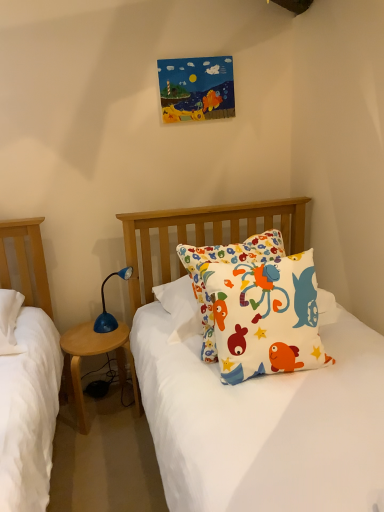
Question: Is blue plastic lamp at lower left inside white cotton pillow with colorful fish designs at center?

Choices:
 (A) yes
 (B) no

Answer: (B)

Question: Can you confirm if white cotton pillow with colorful fish designs at center is taller than blue plastic lamp at lower left?

Choices:
 (A) no
 (B) yes

Answer: (B)

Question: Considering the relative sizes of white cotton pillow with colorful fish designs at center and blue plastic lamp at lower left in the image provided, is white cotton pillow with colorful fish designs at center smaller than blue plastic lamp at lower left?

Choices:
 (A) yes
 (B) no

Answer: (B)

Question: Is white cotton pillow with colorful fish designs at center at the right side of blue plastic lamp at lower left?

Choices:
 (A) yes
 (B) no

Answer: (A)

Question: From a real-world perspective, is white cotton pillow with colorful fish designs at center physically below blue plastic lamp at lower left?

Choices:
 (A) yes
 (B) no

Answer: (B)

Question: Is point (238, 308) positioned closer to the camera than point (61, 337)?

Choices:
 (A) closer
 (B) farther

Answer: (A)

Question: In terms of width, does white cotton pillow with colorful fish designs at center look wider or thinner when compared to wooden nightstand at left?

Choices:
 (A) wide
 (B) thin

Answer: (B)

Question: In the image, is white cotton pillow with colorful fish designs at center on the left side or the right side of wooden nightstand at left?

Choices:
 (A) left
 (B) right

Answer: (B)

Question: Is white cotton pillow with colorful fish designs at center in front of or behind wooden nightstand at left in the image?

Choices:
 (A) behind
 (B) front

Answer: (B)

Question: Is blue plastic lamp at lower left inside the boundaries of white cotton pillow with colorful fish designs at center, or outside?

Choices:
 (A) outside
 (B) inside

Answer: (A)

Question: Considering the positions of blue plastic lamp at lower left and white cotton pillow with colorful fish designs at center in the image, is blue plastic lamp at lower left wider or thinner than white cotton pillow with colorful fish designs at center?

Choices:
 (A) thin
 (B) wide

Answer: (A)

Question: Considering the positions of blue plastic lamp at lower left and white cotton pillow with colorful fish designs at center in the image, is blue plastic lamp at lower left bigger or smaller than white cotton pillow with colorful fish designs at center?

Choices:
 (A) big
 (B) small

Answer: (B)

Question: From the image's perspective, is blue plastic lamp at lower left positioned above or below white cotton pillow with colorful fish designs at center?

Choices:
 (A) below
 (B) above

Answer: (A)

Question: In the image, is wooden nightstand at left positioned in front of or behind white cotton pillow with colorful fish designs at center?

Choices:
 (A) behind
 (B) front

Answer: (A)

Question: From the image's perspective, is wooden nightstand at left above or below white cotton pillow with colorful fish designs at center?

Choices:
 (A) above
 (B) below

Answer: (B)